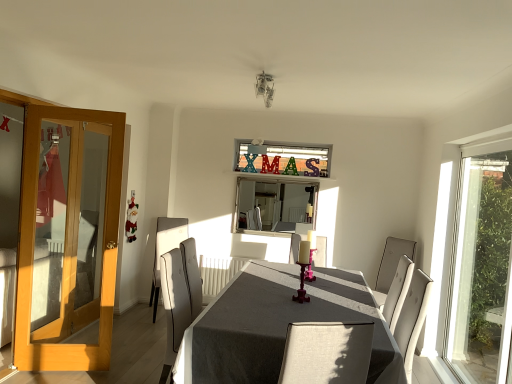
Question: From the image's perspective, relative to light gray fabric chair at center, the 1th chair positioned from the left, is gray fabric table at center above or below?

Choices:
 (A) above
 (B) below

Answer: (B)

Question: In terms of height, does gray fabric table at center look taller or shorter compared to light gray fabric chair at center, the 1th chair positioned from the left?

Choices:
 (A) tall
 (B) short

Answer: (B)

Question: Which object is the farthest from the light gray fabric chair at center, the 1th chair positioned from the left?

Choices:
 (A) pink glossy candle holder at center
 (B) light brown wooden door at left
 (C) white fabric chair at right, the 1th chair when ordered from right to left
 (D) gray fabric table at center
 (E) silver metallic mirror at center

Answer: (C)

Question: Which is nearer to the gray fabric table at center?

Choices:
 (A) white fabric chair at right, the 1th chair when ordered from right to left
 (B) silver metallic mirror at center
 (C) light gray fabric chair at center, the 1th chair positioned from the left
 (D) pink glossy candle holder at center
 (E) light brown wooden door at left

Answer: (D)